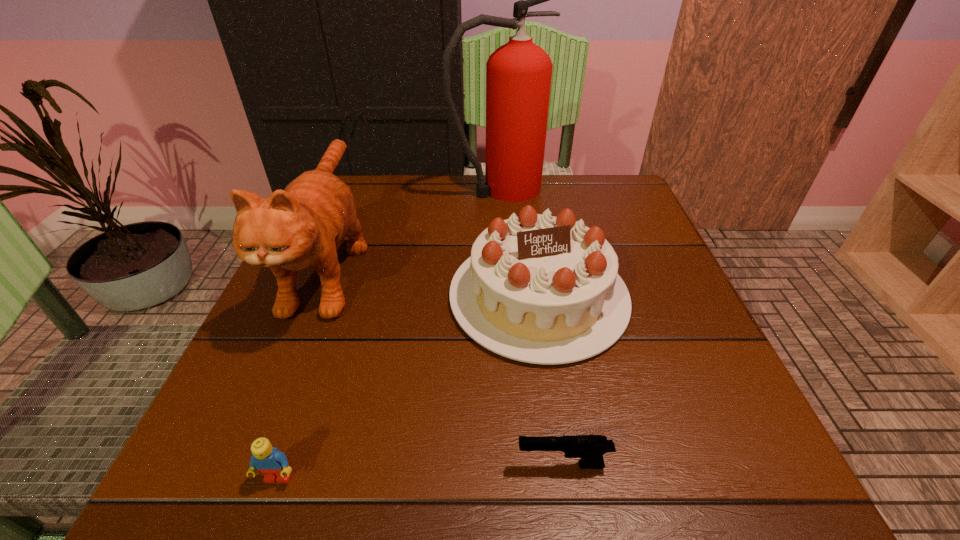
In order to click on free space between the cat and the birthday cake in this screenshot , I will do `click(434, 280)`.

The image size is (960, 540). Find the location of `blank region between the pistol and the fourth tallest object`. blank region between the pistol and the fourth tallest object is located at coordinates (420, 471).

Identify the location of free space between the shortest object and the fourth tallest object. Image resolution: width=960 pixels, height=540 pixels. (420, 471).

The image size is (960, 540). What are the coordinates of `free spot between the Lego and the shortest object` in the screenshot? It's located at click(420, 471).

Locate an element on the screen. vacant area that lies between the farthest object and the second shortest object is located at coordinates (389, 333).

The image size is (960, 540). What are the coordinates of `empty space between the fourth shortest object and the shortest object` in the screenshot? It's located at (446, 364).

The image size is (960, 540). What are the coordinates of `unoccupied position between the fourth tallest object and the birthday cake` in the screenshot? It's located at (408, 387).

You are a GUI agent. You are given a task and a screenshot of the screen. Output one action in this format:
    pyautogui.click(x=<x>, y=<y>)
    Task: Click on the object that is the fourth closest one to the fire extinguisher
    The image size is (960, 540).
    Given the screenshot: What is the action you would take?
    pyautogui.click(x=273, y=464)

This screenshot has width=960, height=540. What are the coordinates of `object that stands as the fourth closest to the third shortest object` in the screenshot? It's located at (273, 464).

The height and width of the screenshot is (540, 960). Identify the location of free spot that satisfies the following two spatial constraints: 1. on the face of the second tallest object; 2. on the right side of the birthday cake. (317, 296).